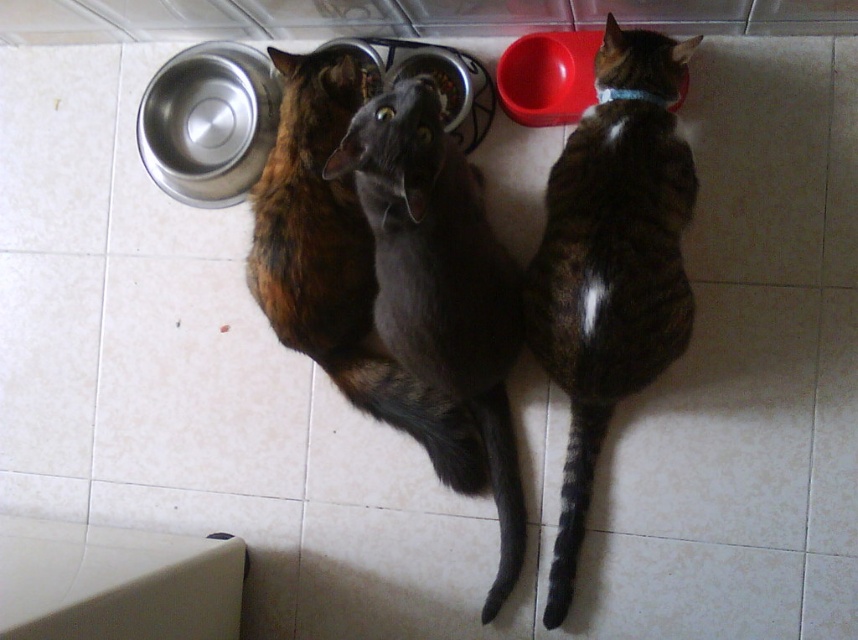
Which is behind, point (523, 516) or point (331, 49)?

The point (331, 49) is behind.

Does shiny gray cat at center have a greater width compared to brushed metal bowl at upper center?

Correct, the width of shiny gray cat at center exceeds that of brushed metal bowl at upper center.

Which is in front, point (390, 349) or point (367, 51)?

Positioned in front is point (390, 349).

At what (x,y) coordinates should I click in order to perform the action: click on shiny gray cat at center. Please return your answer as a coordinate pair (x, y). The image size is (858, 640). Looking at the image, I should click on (440, 284).

This screenshot has width=858, height=640. What do you see at coordinates (611, 260) in the screenshot?
I see `tabby fur cat at right` at bounding box center [611, 260].

Is tabby fur cat at right wider than shiny gray cat at center?

In fact, tabby fur cat at right might be narrower than shiny gray cat at center.

Locate an element on the screen. The height and width of the screenshot is (640, 858). tabby fur cat at right is located at coordinates (611, 260).

I want to click on tabby fur cat at right, so click(x=611, y=260).

Who is lower down, tabby fur cat at right or calico fur cat at center?

tabby fur cat at right is below.

Which is more to the right, tabby fur cat at right or calico fur cat at center?

From the viewer's perspective, tabby fur cat at right appears more on the right side.

Where is `tabby fur cat at right`? tabby fur cat at right is located at coordinates (611, 260).